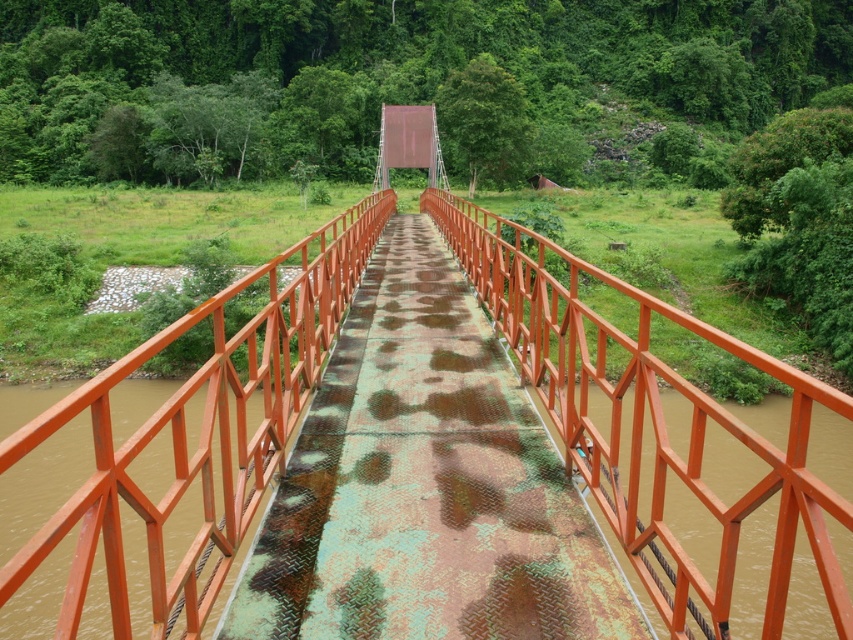
Is rusty metal bridge at center above orange metal/rustic rail at center?

Incorrect, rusty metal bridge at center is not positioned above orange metal/rustic rail at center.

Does point (427, 573) come farther from viewer compared to point (114, 516)?

That is True.

Is point (367, 404) less distant than point (79, 570)?

No, (367, 404) is behind (79, 570).

Where is `rusty metal bridge at center`? The image size is (853, 640). rusty metal bridge at center is located at coordinates (425, 484).